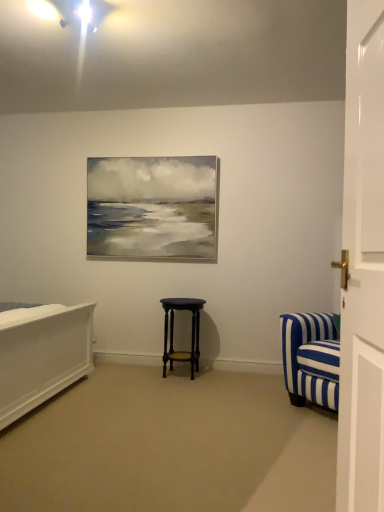
Question: Is white glossy door at right touching matte black stool at center?

Choices:
 (A) no
 (B) yes

Answer: (A)

Question: Does white glossy door at right appear on the left side of matte black stool at center?

Choices:
 (A) no
 (B) yes

Answer: (A)

Question: Considering the relative sizes of white glossy door at right and matte black stool at center in the image provided, is white glossy door at right taller than matte black stool at center?

Choices:
 (A) no
 (B) yes

Answer: (B)

Question: Does white glossy door at right have a lesser height compared to matte black stool at center?

Choices:
 (A) no
 (B) yes

Answer: (A)

Question: From a real-world perspective, is white glossy door at right under matte black stool at center?

Choices:
 (A) no
 (B) yes

Answer: (A)

Question: Can you confirm if white glossy door at right is thinner than matte black stool at center?

Choices:
 (A) no
 (B) yes

Answer: (B)

Question: Is matte black stool at center turned away from white glossy door at right?

Choices:
 (A) no
 (B) yes

Answer: (A)

Question: Is matte black stool at center far from white glossy door at right?

Choices:
 (A) no
 (B) yes

Answer: (B)

Question: Is matte black stool at center bigger than white glossy door at right?

Choices:
 (A) yes
 (B) no

Answer: (A)

Question: Can you confirm if matte black stool at center is positioned to the right of white glossy door at right?

Choices:
 (A) yes
 (B) no

Answer: (B)

Question: Considering the relative positions of matte black stool at center and white glossy door at right in the image provided, is matte black stool at center in front of white glossy door at right?

Choices:
 (A) yes
 (B) no

Answer: (B)

Question: Is matte black stool at center wider than white glossy door at right?

Choices:
 (A) yes
 (B) no

Answer: (A)

Question: Would you say white glossy door at right is to the left or to the right of matte black stool at center in the picture?

Choices:
 (A) left
 (B) right

Answer: (B)